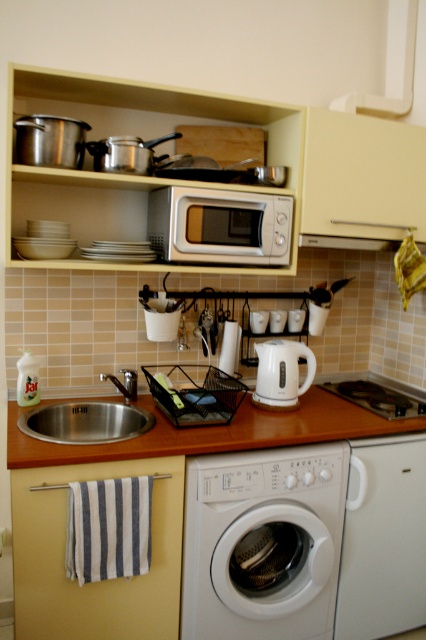
Question: Is the position of white plastic washing machine at lower center more distant than that of silver metallic microwave at center?

Choices:
 (A) no
 (B) yes

Answer: (A)

Question: Which object appears farthest from the camera in this image?

Choices:
 (A) white plastic washing machine at lower center
 (B) stainless steel sink at lower left
 (C) wooden at center

Answer: (A)

Question: Is white plastic washing machine at lower center wider than wooden at center?

Choices:
 (A) no
 (B) yes

Answer: (A)

Question: Which point is farther to the camera?

Choices:
 (A) (322, 536)
 (B) (356, 241)
 (C) (232, 269)
 (D) (284, 340)

Answer: (B)

Question: Does stainless steel sink at lower left lie behind white glossy electric kettle at center?

Choices:
 (A) no
 (B) yes

Answer: (A)

Question: Which object is closer to the camera taking this photo?

Choices:
 (A) stainless steel sink at lower left
 (B) white glossy electric kettle at center
 (C) wooden at center

Answer: (C)